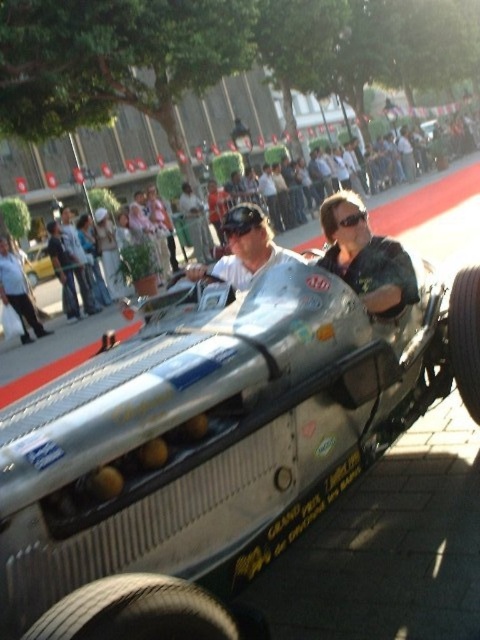
Can you confirm if metallic silver helmet at center is smaller than white shirt at left?

Yes.

Is point (355, 250) closer to viewer compared to point (21, 321)?

Yes, point (355, 250) is closer to viewer.

Is point (373, 305) positioned before point (24, 316)?

That is True.

Find the location of a particular element. The height and width of the screenshot is (640, 480). metallic silver helmet at center is located at coordinates (365, 257).

Consider the image. Is matte silver helmet at center wider than silver metallic racecar at center?

No.

The image size is (480, 640). What do you see at coordinates (243, 248) in the screenshot?
I see `matte silver helmet at center` at bounding box center [243, 248].

Where is `matte silver helmet at center`? This screenshot has width=480, height=640. matte silver helmet at center is located at coordinates (243, 248).

Does metallic silver helmet at center have a lesser width compared to black rubber tire at lower right?

No, metallic silver helmet at center is not thinner than black rubber tire at lower right.

The image size is (480, 640). I want to click on metallic silver helmet at center, so click(x=365, y=257).

Which is in front, point (362, 225) or point (469, 412)?

Point (469, 412) is more forward.

You are a GUI agent. You are given a task and a screenshot of the screen. Output one action in this format:
    pyautogui.click(x=<x>, y=<y>)
    Task: Click on the metallic silver helmet at center
    The height and width of the screenshot is (640, 480).
    Given the screenshot: What is the action you would take?
    (x=365, y=257)